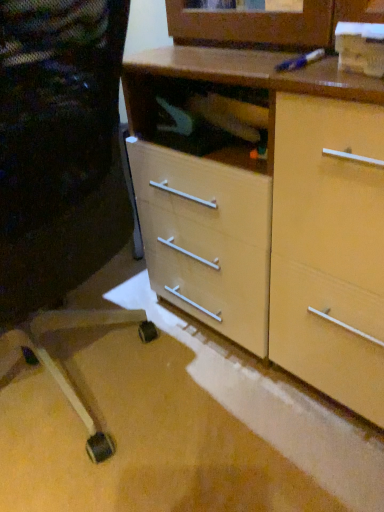
Image resolution: width=384 pixels, height=512 pixels. Find the location of `vacant space in matte black chair at lower left (from a real-world perspective)`. vacant space in matte black chair at lower left (from a real-world perspective) is located at coordinates (82, 398).